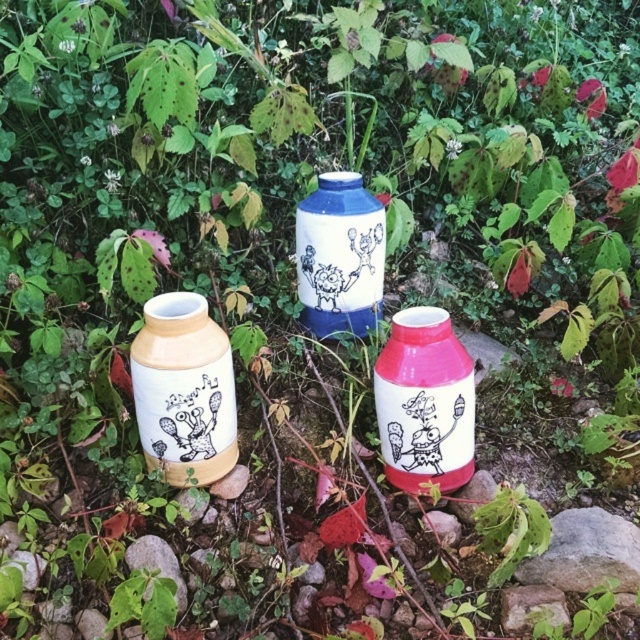
How distant is matte yellow vase at left from gray rock at center?

27.50 inches

Can you confirm if matte yellow vase at left is wider than gray rock at center?

No.

Identify the location of matte yellow vase at left. (182, 390).

Is matte yellow vase at left wider than blue glazed vase at center?

In fact, matte yellow vase at left might be narrower than blue glazed vase at center.

Does matte yellow vase at left have a lesser width compared to blue glazed vase at center?

Yes.

Between point (196, 308) and point (353, 173), which one is positioned in front?

Point (196, 308) is in front.

Locate an element on the screen. matte yellow vase at left is located at coordinates (182, 390).

Is matte ceramic bottle at center further to camera compared to gray rock at center?

Yes, matte ceramic bottle at center is further from the viewer.

Which is below, matte ceramic bottle at center or gray rock at center?

gray rock at center

What do you see at coordinates (424, 403) in the screenshot? The height and width of the screenshot is (640, 640). I see `matte ceramic bottle at center` at bounding box center [424, 403].

You are a GUI agent. You are given a task and a screenshot of the screen. Output one action in this format:
    pyautogui.click(x=<x>, y=<y>)
    Task: Click on the matte ceramic bottle at center
    
    Given the screenshot: What is the action you would take?
    pyautogui.click(x=424, y=403)